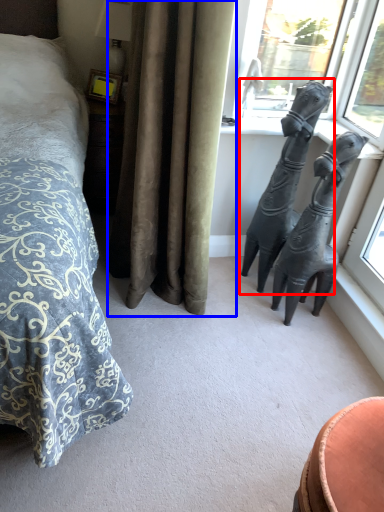
Question: Which object is further to the camera taking this photo, statue (sculpture) (highlighted by a red box) or curtain (highlighted by a blue box)?

Choices:
 (A) statue (sculpture)
 (B) curtain

Answer: (A)